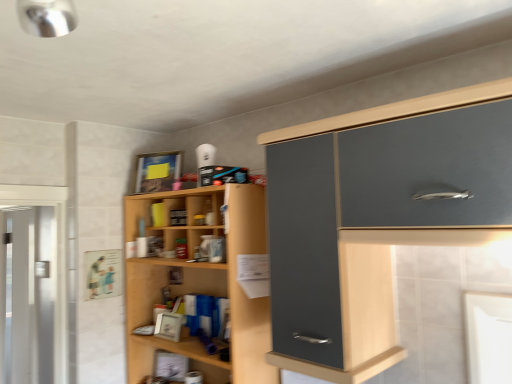
Question: Does matte gray cabinet at upper right have a greater width compared to clear glass screen door at left?

Choices:
 (A) no
 (B) yes

Answer: (B)

Question: Is matte gray cabinet at upper right to the left of clear glass screen door at left from the viewer's perspective?

Choices:
 (A) no
 (B) yes

Answer: (A)

Question: Can you confirm if matte gray cabinet at upper right is shorter than clear glass screen door at left?

Choices:
 (A) yes
 (B) no

Answer: (A)

Question: Is matte gray cabinet at upper right touching clear glass screen door at left?

Choices:
 (A) yes
 (B) no

Answer: (B)

Question: From a real-world perspective, is matte gray cabinet at upper right below clear glass screen door at left?

Choices:
 (A) no
 (B) yes

Answer: (A)

Question: Visually, is clear glass screen door at left positioned to the left or to the right of wooden shelves at center?

Choices:
 (A) right
 (B) left

Answer: (B)

Question: Considering the positions of clear glass screen door at left and wooden shelves at center in the image, is clear glass screen door at left bigger or smaller than wooden shelves at center?

Choices:
 (A) small
 (B) big

Answer: (A)

Question: Considering the positions of clear glass screen door at left and wooden shelves at center in the image, is clear glass screen door at left wider or thinner than wooden shelves at center?

Choices:
 (A) wide
 (B) thin

Answer: (B)

Question: From their relative heights in the image, would you say clear glass screen door at left is taller or shorter than wooden shelves at center?

Choices:
 (A) tall
 (B) short

Answer: (A)

Question: In the image, is wooden shelves at center positioned in front of or behind clear glass screen door at left?

Choices:
 (A) behind
 (B) front

Answer: (B)

Question: Is point (132, 360) positioned closer to the camera than point (24, 276)?

Choices:
 (A) closer
 (B) farther

Answer: (A)

Question: In terms of width, does wooden shelves at center look wider or thinner when compared to clear glass screen door at left?

Choices:
 (A) thin
 (B) wide

Answer: (B)

Question: From a real-world perspective, relative to clear glass screen door at left, is wooden shelves at center vertically above or below?

Choices:
 (A) below
 (B) above

Answer: (B)

Question: Is clear glass screen door at left inside the boundaries of matte gray cabinet at upper right, or outside?

Choices:
 (A) inside
 (B) outside

Answer: (B)

Question: Considering the positions of clear glass screen door at left and matte gray cabinet at upper right in the image, is clear glass screen door at left taller or shorter than matte gray cabinet at upper right?

Choices:
 (A) short
 (B) tall

Answer: (B)